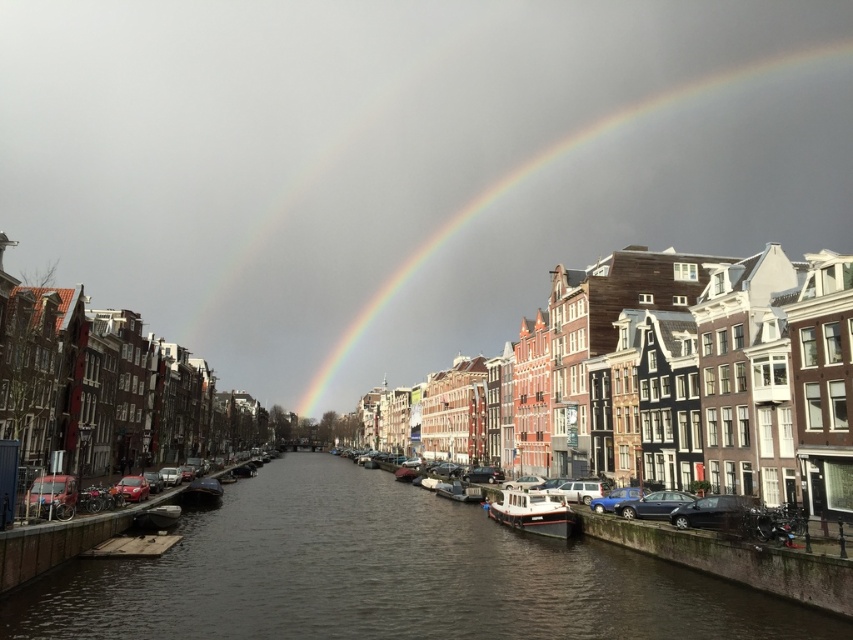
Which is more to the left, rainbow at upper center or smooth wooden boat at center?

smooth wooden boat at center is more to the left.

Which of these two, rainbow at upper center or smooth wooden boat at center, stands taller?

With more height is rainbow at upper center.

Is point (396, 289) closer to viewer compared to point (180, 512)?

No, it is not.

I want to click on rainbow at upper center, so click(537, 172).

Does rainbow at upper center appear over wooden boat at center?

Correct, rainbow at upper center is located above wooden boat at center.

Who is more forward, [804,56] or [189,492]?

Point [189,492] is more forward.

Image resolution: width=853 pixels, height=640 pixels. In order to click on rainbow at upper center in this screenshot , I will do `click(537, 172)`.

Based on the photo, between smooth wooden boat at center and wooden boat at center, which one is positioned higher?

Positioned higher is smooth wooden boat at center.

Is point (138, 528) positioned behind point (189, 483)?

No.

Where is `smooth wooden boat at center`? smooth wooden boat at center is located at coordinates (155, 516).